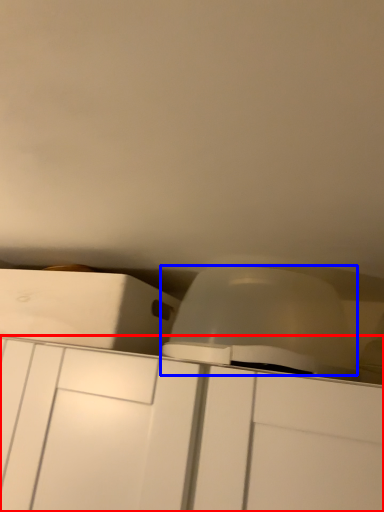
Question: Which of the following is the farthest to the observer, cabinetry (highlighted by a red box) or lift (highlighted by a blue box)?

Choices:
 (A) cabinetry
 (B) lift

Answer: (B)